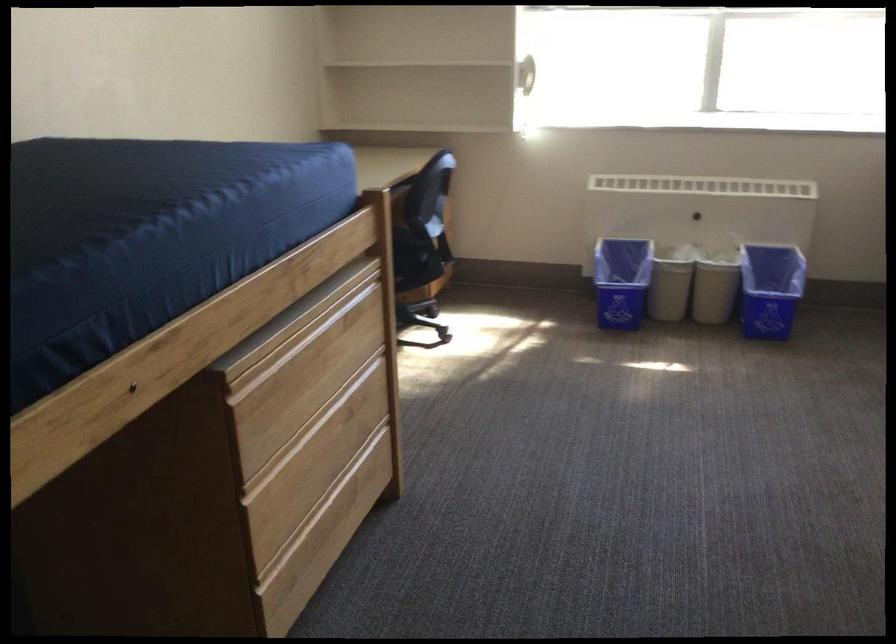
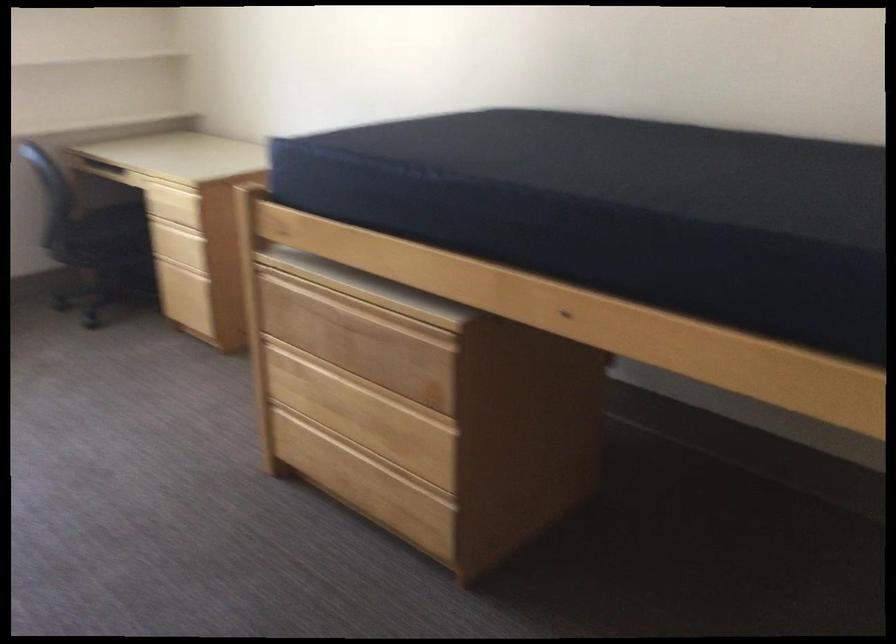
Question: The first image is from the beginning of the video and the second image is from the end. How did the camera likely rotate when shooting the video?

Choices:
 (A) Left
 (B) Right
 (C) Up
 (D) Down

Answer: (B)